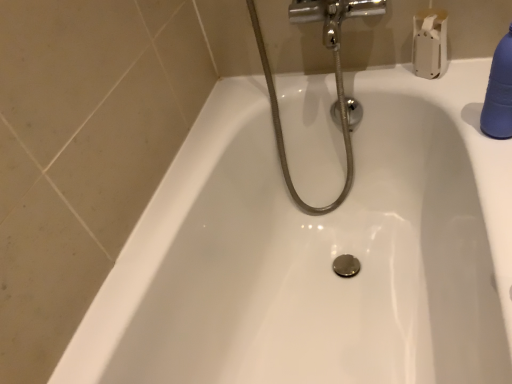
Question: Considering the positions of point (335, 57) and point (419, 23), is point (335, 57) closer or farther from the camera than point (419, 23)?

Choices:
 (A) closer
 (B) farther

Answer: (A)

Question: In terms of height, does chrome metallic showerhead at upper center look taller or shorter compared to white matte toilet paper at upper right?

Choices:
 (A) short
 (B) tall

Answer: (B)

Question: Which of these objects is positioned closest to the blue rubber bottle at upper right?

Choices:
 (A) chrome metallic showerhead at upper center
 (B) white matte toilet paper at upper right

Answer: (B)

Question: Based on their relative distances, which object is nearer to the white matte toilet paper at upper right?

Choices:
 (A) chrome metallic showerhead at upper center
 (B) blue rubber bottle at upper right

Answer: (A)